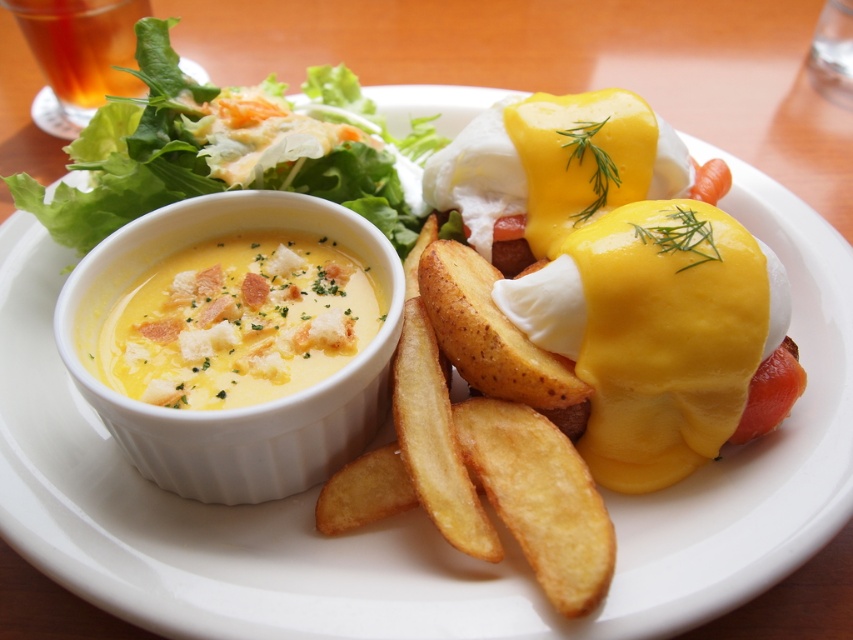
Which is in front, point (234, 344) or point (148, 109)?

Point (234, 344)

Find the location of `yellow creamy soup at center`. yellow creamy soup at center is located at coordinates (238, 321).

Find the location of a particular element. yellow creamy soup at center is located at coordinates (238, 321).

Is golden crispy french fries at center above green leafy salad at upper left?

Incorrect, golden crispy french fries at center is not positioned above green leafy salad at upper left.

Is point (351, 497) more distant than point (387, 163)?

No, it is in front of (387, 163).

The image size is (853, 640). Identify the location of golden crispy french fries at center. (474, 460).

Is golden crispy french fries at center to the left of yellow creamy soup at center from the viewer's perspective?

No, golden crispy french fries at center is not to the left of yellow creamy soup at center.

Where is `golden crispy french fries at center`? This screenshot has width=853, height=640. golden crispy french fries at center is located at coordinates (474, 460).

Between point (315, 506) and point (264, 362), which one is positioned behind?

Point (264, 362)

At what (x,y) coordinates should I click in order to perform the action: click on golden crispy french fries at center. Please return your answer as a coordinate pair (x, y). This screenshot has width=853, height=640. Looking at the image, I should click on (474, 460).